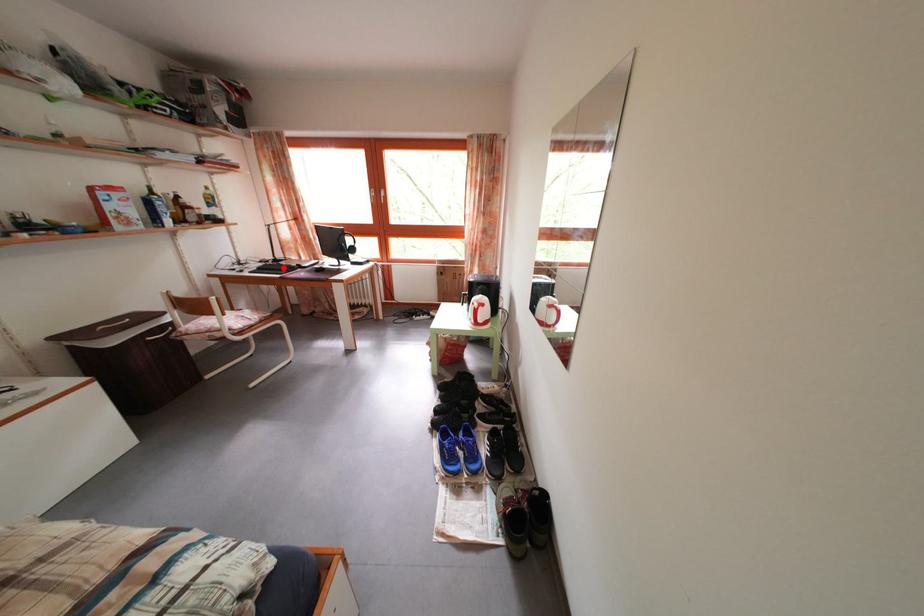
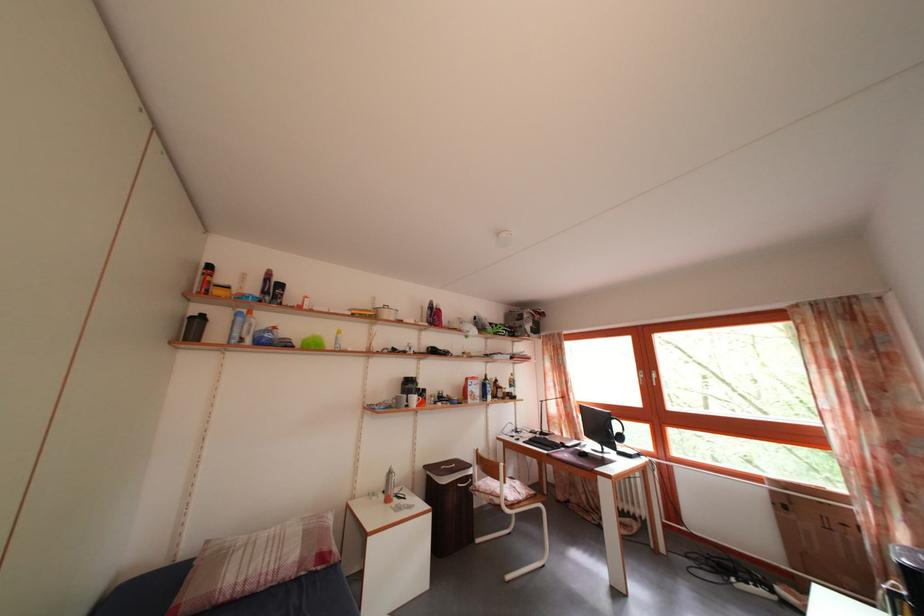
Question: A red point is marked in image1. In image2, is the corresponding 3D point closer to the camera or farther? Reply with the corresponding letter.

Choices:
 (A) The corresponding 3D point is closer.
 (B) The corresponding 3D point is farther.

Answer: (B)